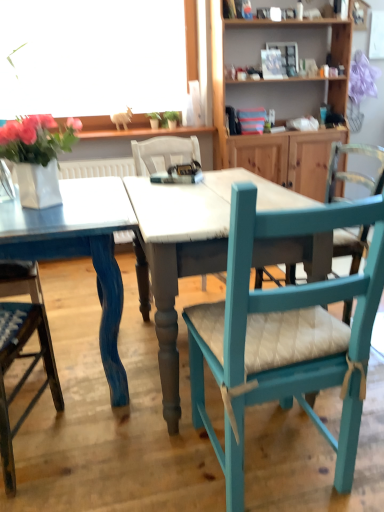
Question: Considering the relative sizes of white glossy vase at upper left and blue painted wood table at center in the image provided, is white glossy vase at upper left bigger than blue painted wood table at center?

Choices:
 (A) no
 (B) yes

Answer: (A)

Question: Is white glossy vase at upper left next to blue painted wood table at center and touching it?

Choices:
 (A) yes
 (B) no

Answer: (B)

Question: From the image's perspective, does white glossy vase at upper left appear lower than blue painted wood table at center?

Choices:
 (A) yes
 (B) no

Answer: (B)

Question: Can you confirm if white glossy vase at upper left is wider than blue painted wood table at center?

Choices:
 (A) no
 (B) yes

Answer: (A)

Question: Can you confirm if white glossy vase at upper left is shorter than blue painted wood table at center?

Choices:
 (A) yes
 (B) no

Answer: (B)

Question: In terms of width, does wooden cabinet at upper right look wider or thinner when compared to blue painted wood table at center?

Choices:
 (A) thin
 (B) wide

Answer: (A)

Question: From the image's perspective, is wooden cabinet at upper right above or below blue painted wood table at center?

Choices:
 (A) below
 (B) above

Answer: (B)

Question: Does point (296, 20) appear closer or farther from the camera than point (317, 249)?

Choices:
 (A) farther
 (B) closer

Answer: (A)

Question: Is wooden cabinet at upper right situated inside blue painted wood table at center or outside?

Choices:
 (A) inside
 (B) outside

Answer: (B)

Question: In terms of size, does white glossy vase at upper left appear bigger or smaller than wooden cabinet at upper right?

Choices:
 (A) big
 (B) small

Answer: (B)

Question: Looking at their shapes, would you say white glossy vase at upper left is wider or thinner than wooden cabinet at upper right?

Choices:
 (A) thin
 (B) wide

Answer: (A)

Question: Visually, is white glossy vase at upper left positioned to the left or to the right of wooden cabinet at upper right?

Choices:
 (A) right
 (B) left

Answer: (B)

Question: Is white glossy vase at upper left situated inside wooden cabinet at upper right or outside?

Choices:
 (A) outside
 (B) inside

Answer: (A)

Question: Would you say white glossy vase at upper left is to the left or to the right of teal painted wood chair at right, acting as the 2th chair starting from the left, in the picture?

Choices:
 (A) left
 (B) right

Answer: (A)

Question: From a real-world perspective, is white glossy vase at upper left positioned above or below teal painted wood chair at right, acting as the 2th chair starting from the left?

Choices:
 (A) above
 (B) below

Answer: (A)